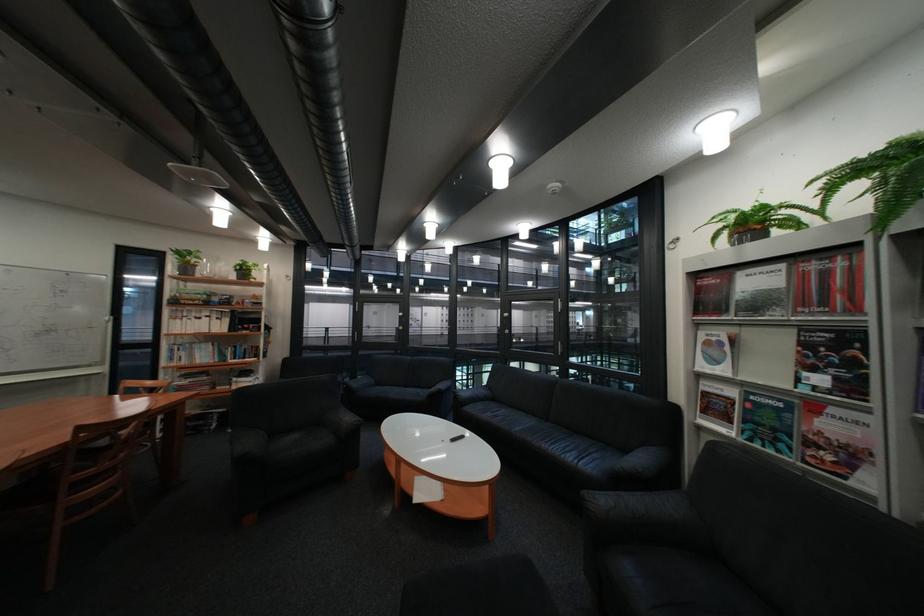
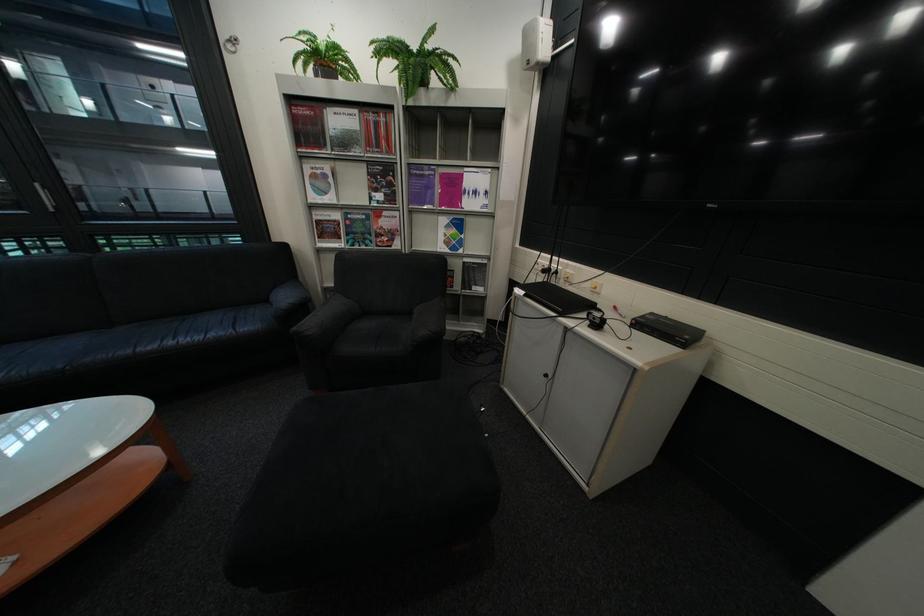
Find the pixel in the second image that matches the point at 879,379 in the first image.

(409, 192)